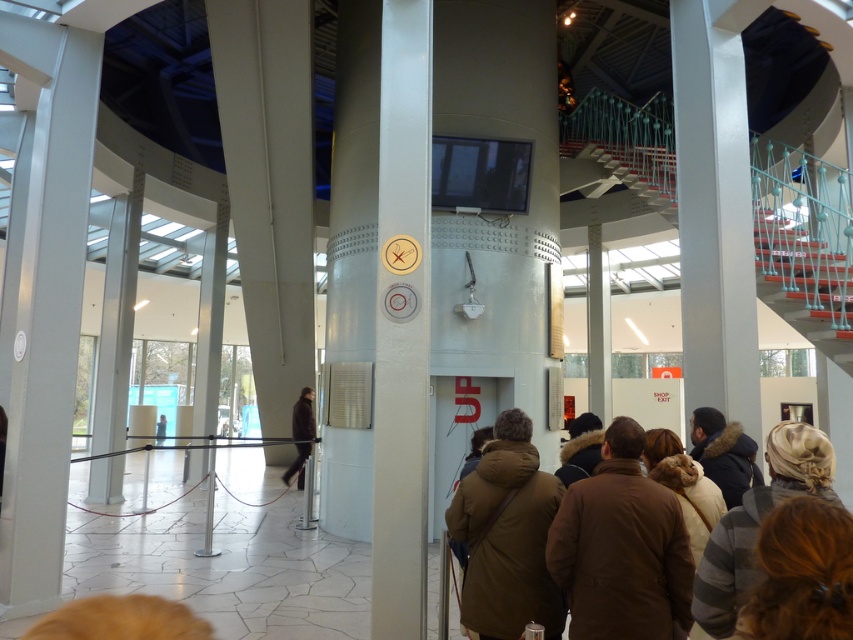
Question: Which object is closer to the camera taking this photo?

Choices:
 (A) brown matte coat at center
 (B) teal plastic staircase at upper right
 (C) striped knit hat at lower right

Answer: (C)

Question: Based on their relative distances, which object is nearer to the brown leather jacket at center?

Choices:
 (A) brown matte coat at center
 (B) teal plastic staircase at upper right
 (C) white glossy pillar at center
 (D) dark blue fur-lined coat at lower right

Answer: (A)

Question: Is white glossy pillar at center smaller than dark brown leather coat at center?

Choices:
 (A) yes
 (B) no

Answer: (A)

Question: Is brown leather jacket at center above brown matte coat at center?

Choices:
 (A) no
 (B) yes

Answer: (B)

Question: Which of the following is the farthest from the observer?

Choices:
 (A) white glossy pillar at center
 (B) dark brown leather coat at center

Answer: (B)

Question: Is white glossy pillar at center smaller than brown woolen coat at center?

Choices:
 (A) no
 (B) yes

Answer: (A)